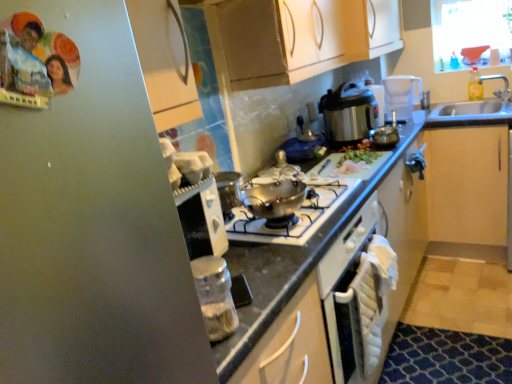
What is the approximate height of clear glass jar at lower center, positioned as the 1th kitchen appliance in bottom-to-top order?

It is 6.47 inches.

Describe the element at coordinates (323, 280) in the screenshot. This screenshot has width=512, height=384. I see `black granite countertop at center` at that location.

Locate an element on the screen. black granite countertop at center is located at coordinates (323, 280).

Where is `clear plastic bottle at upper right`? The image size is (512, 384). clear plastic bottle at upper right is located at coordinates (475, 86).

Measure the distance between point (474, 231) and camera.

Point (474, 231) and camera are 8.55 feet apart.

What do you see at coordinates (467, 184) in the screenshot?
I see `light wood cabinet at right` at bounding box center [467, 184].

Locate an element on the screen. The height and width of the screenshot is (384, 512). clear glass jar at lower center, the first kitchen appliance positioned from the left is located at coordinates (215, 296).

Would you say shiny metallic pot at center is to the left or to the right of clear glass jar at lower center, the second kitchen appliance from the right, in the picture?

From the image, it's evident that shiny metallic pot at center is to the right of clear glass jar at lower center, the second kitchen appliance from the right.

Which point is more forward, (291, 234) or (218, 292)?

The point (218, 292) is more forward.

Is shiny metallic pot at center situated inside clear glass jar at lower center, the second kitchen appliance from the top, or outside?

shiny metallic pot at center lies outside clear glass jar at lower center, the second kitchen appliance from the top.

From the image's perspective, is shiny metallic pot at center beneath clear glass jar at lower center, which is the 2th kitchen appliance in back-to-front order?

No.

How distant is light wood cabinet at right from stainless steel pressure cooker at upper right, marked as the first kitchen appliance in a top-to-bottom arrangement?

28.31 inches.

Can you confirm if light wood cabinet at right is positioned to the right of stainless steel pressure cooker at upper right, the 1th kitchen appliance from the back?

Indeed, light wood cabinet at right is positioned on the right side of stainless steel pressure cooker at upper right, the 1th kitchen appliance from the back.

Would you say stainless steel pressure cooker at upper right, which is the 1th kitchen appliance in right-to-left order, is part of light wood cabinet at right's contents?

Actually, stainless steel pressure cooker at upper right, which is the 1th kitchen appliance in right-to-left order, is outside light wood cabinet at right.

What's the angular difference between light wood cabinet at right and stainless steel pressure cooker at upper right, which is the 1th kitchen appliance in right-to-left order,'s facing directions?

93.9 degrees separate the facing orientations of light wood cabinet at right and stainless steel pressure cooker at upper right, which is the 1th kitchen appliance in right-to-left order.

Which object is positioned more to the right, light wood cabinet at right or black granite countertop at center?

From the viewer's perspective, light wood cabinet at right appears more on the right side.

From a real-world perspective, which is physically above, light wood cabinet at right or black granite countertop at center?

In real-world perspective, black granite countertop at center is above.

Which is in front, point (456, 177) or point (408, 139)?

The point (408, 139) is in front.

Is light wood cabinet at right not inside black granite countertop at center?

Yes.

In the image, is shiny metallic pot at center on the left side or the right side of stainless steel pressure cooker at upper right, the 1th kitchen appliance from the back?

shiny metallic pot at center is positioned on stainless steel pressure cooker at upper right, the 1th kitchen appliance from the back,'s left side.

Considering their positions, is shiny metallic pot at center located in front of or behind stainless steel pressure cooker at upper right, the 2th kitchen appliance ordered from the bottom?

Clearly, shiny metallic pot at center is in front of stainless steel pressure cooker at upper right, the 2th kitchen appliance ordered from the bottom.

From the image's perspective, relative to stainless steel pressure cooker at upper right, which is the second kitchen appliance from front to back, is shiny metallic pot at center above or below?

From the image's perspective, shiny metallic pot at center appears below stainless steel pressure cooker at upper right, which is the second kitchen appliance from front to back.

From a real-world perspective, is shiny metallic pot at center on stainless steel pressure cooker at upper right, which ranks as the second kitchen appliance in left-to-right order?

No, from a real-world perspective, shiny metallic pot at center is not on top of stainless steel pressure cooker at upper right, which ranks as the second kitchen appliance in left-to-right order.

Which object is further away from the camera taking this photo, white plastic blender at upper right or clear glass jar at lower center, the first kitchen appliance positioned from the left?

white plastic blender at upper right is more distant.

Which of these two, white plastic blender at upper right or clear glass jar at lower center, which is the 2th kitchen appliance in back-to-front order, is thinner?

With smaller width is clear glass jar at lower center, which is the 2th kitchen appliance in back-to-front order.

Does point (409, 118) come in front of point (213, 299)?

No, (409, 118) is further to viewer.

How different are the orientations of white plastic blender at upper right and clear glass jar at lower center, which is the 2th kitchen appliance in back-to-front order, in degrees?

There is a 55.9-degree angle between the facing directions of white plastic blender at upper right and clear glass jar at lower center, which is the 2th kitchen appliance in back-to-front order.

Considering the relative sizes of clear glass jar at lower center, positioned as the 1th kitchen appliance in bottom-to-top order, and white plastic blender at upper right in the image provided, is clear glass jar at lower center, positioned as the 1th kitchen appliance in bottom-to-top order, smaller than white plastic blender at upper right?

Correct, clear glass jar at lower center, positioned as the 1th kitchen appliance in bottom-to-top order, occupies less space than white plastic blender at upper right.

Is point (205, 315) farther from camera compared to point (396, 78)?

No, it is not.

From a real-world perspective, is clear glass jar at lower center, the second kitchen appliance from the top, located higher than white plastic blender at upper right?

No.

Is clear plastic bottle at upper right next to black granite countertop at center and touching it?

No.

From the image's perspective, is clear plastic bottle at upper right beneath black granite countertop at center?

No, from the image's perspective, clear plastic bottle at upper right is not beneath black granite countertop at center.

Considering the relative sizes of clear plastic bottle at upper right and black granite countertop at center in the image provided, is clear plastic bottle at upper right taller than black granite countertop at center?

Incorrect, the height of clear plastic bottle at upper right is not larger of that of black granite countertop at center.

At what (x,y) coordinates should I click in order to perform the action: click on kitchen appliance in front of the shiny metallic pot at center. Please return your answer as a coordinate pair (x, y). This screenshot has height=384, width=512. Looking at the image, I should click on (215, 296).

You are a GUI agent. You are given a task and a screenshot of the screen. Output one action in this format:
    pyautogui.click(x=<x>, y=<y>)
    Task: Click on the kitchen appliance that is the 2nd one above the light wood cabinet at right (from a real-world perspective)
    This screenshot has height=384, width=512.
    Given the screenshot: What is the action you would take?
    click(x=348, y=114)

Which object lies further to the anchor point clear plastic bottle at upper right, stainless steel pressure cooker at upper right, the 2th kitchen appliance ordered from the bottom, or shiny metallic pot at center?

The object further to clear plastic bottle at upper right is shiny metallic pot at center.

Which object lies further to the anchor point clear plastic bottle at upper right, shiny metallic pot at center or clear glass jar at lower center, the first kitchen appliance positioned from the left?

clear glass jar at lower center, the first kitchen appliance positioned from the left.

When comparing their distances from stainless steel pressure cooker at upper right, which is the second kitchen appliance from front to back, does clear glass jar at lower center, which is the 1th kitchen appliance from front to back, or clear plastic bottle at upper right seem further?

Based on the image, clear glass jar at lower center, which is the 1th kitchen appliance from front to back, appears to be further to stainless steel pressure cooker at upper right, which is the second kitchen appliance from front to back.

Based on the photo, considering their positions, is black granite countertop at center positioned closer to shiny metallic pot at center than light wood cabinet at right?

Among the two, black granite countertop at center is located nearer to shiny metallic pot at center.

Considering their positions, is shiny metallic pot at center positioned closer to clear plastic bottle at upper right than white plastic blender at upper right?

white plastic blender at upper right is closer to clear plastic bottle at upper right.

Which object lies nearer to the anchor point clear plastic bottle at upper right, clear glass jar at lower center, the second kitchen appliance from the right, or white plastic blender at upper right?

white plastic blender at upper right is closer to clear plastic bottle at upper right.

From the image, which object appears to be nearer to stainless steel pressure cooker at upper right, marked as the first kitchen appliance in a top-to-bottom arrangement, black granite countertop at center or light wood cabinet at right?

black granite countertop at center lies closer to stainless steel pressure cooker at upper right, marked as the first kitchen appliance in a top-to-bottom arrangement, than the other object.

Looking at this image, from the image, which object appears to be farther from clear plastic bottle at upper right, stainless steel pressure cooker at upper right, the 1th kitchen appliance from the back, or white plastic blender at upper right?

stainless steel pressure cooker at upper right, the 1th kitchen appliance from the back, is positioned further to the anchor clear plastic bottle at upper right.

This screenshot has width=512, height=384. What are the coordinates of `cabinetry between black granite countertop at center and clear plastic bottle at upper right in the front-back direction` in the screenshot? It's located at (467, 184).

Locate an element on the screen. This screenshot has height=384, width=512. cabinetry located between stainless steel pressure cooker at upper right, which is the 1th kitchen appliance in right-to-left order, and clear plastic bottle at upper right in the left-right direction is located at coordinates (467, 184).

Where is `cabinetry positioned between black granite countertop at center and white plastic blender at upper right from near to far`? cabinetry positioned between black granite countertop at center and white plastic blender at upper right from near to far is located at coordinates [467, 184].

At what (x,y) coordinates should I click in order to perform the action: click on appliance positioned between clear glass jar at lower center, the first kitchen appliance positioned from the left, and clear plastic bottle at upper right from near to far. Please return your answer as a coordinate pair (x, y). This screenshot has height=384, width=512. Looking at the image, I should click on (402, 95).